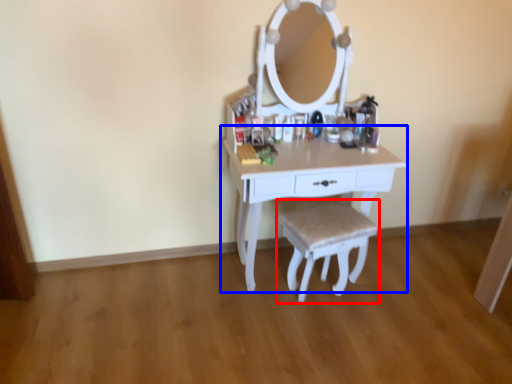
Question: Among these objects, which one is nearest to the camera, step stool (highlighted by a red box) or table (highlighted by a blue box)?

Choices:
 (A) step stool
 (B) table

Answer: (B)